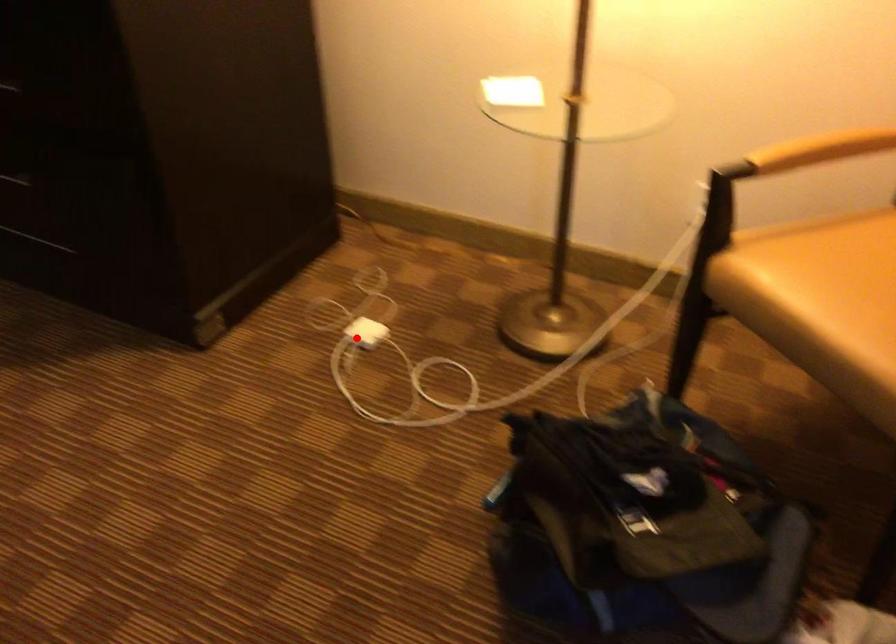
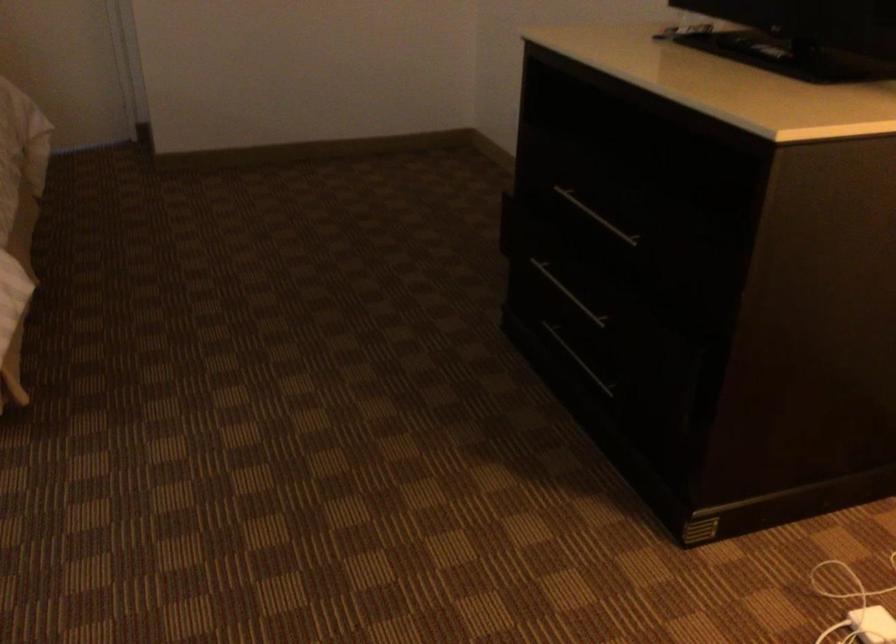
Question: I am providing you with two images of the same scene from different viewpoints. In image1, a red point is highlighted. Considering the same 3D point in image2, which of the following is correct?

Choices:
 (A) It is closer
 (B) It is farther

Answer: (A)